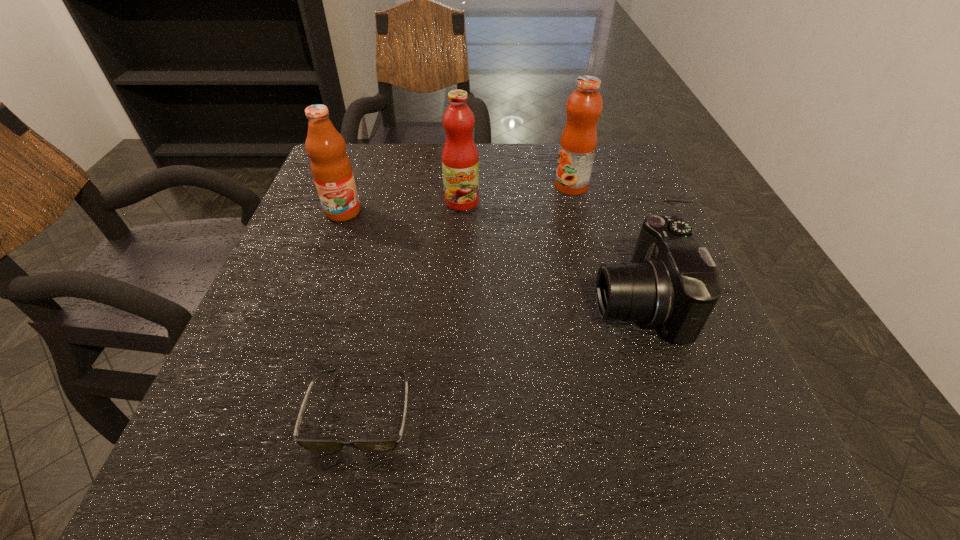
You are a GUI agent. You are given a task and a screenshot of the screen. Output one action in this format:
    pyautogui.click(x=<x>, y=<y>)
    Task: Click on the vacant space located on the front label of the third object from left to right
    The width and height of the screenshot is (960, 540).
    Given the screenshot: What is the action you would take?
    pyautogui.click(x=457, y=295)

The width and height of the screenshot is (960, 540). I want to click on vacant area situated on the front label of the leftmost object, so click(284, 375).

At what (x,y) coordinates should I click in order to perform the action: click on free space located 0.050m on the lens of the fourth tallest object. Please return your answer as a coordinate pair (x, y). The height and width of the screenshot is (540, 960). Looking at the image, I should click on (566, 301).

Locate an element on the screen. Image resolution: width=960 pixels, height=540 pixels. vacant area situated on the lens of the fourth tallest object is located at coordinates (550, 301).

Find the location of a particular element. This screenshot has width=960, height=540. free space located 0.070m on the lens of the fourth tallest object is located at coordinates (556, 301).

You are a GUI agent. You are given a task and a screenshot of the screen. Output one action in this format:
    pyautogui.click(x=<x>, y=<y>)
    Task: Click on the free region located on the front-facing side of the shortest object
    The image size is (960, 540).
    Given the screenshot: What is the action you would take?
    (x=341, y=501)

The height and width of the screenshot is (540, 960). I want to click on object that is at the near edge, so click(388, 444).

Find the location of a particular element. The image size is (960, 540). fruit juice situated at the left edge is located at coordinates [330, 166].

The image size is (960, 540). I want to click on sunglasses located in the left edge section of the desktop, so (x=388, y=444).

Identify the location of fruit juice present at the right edge. (578, 142).